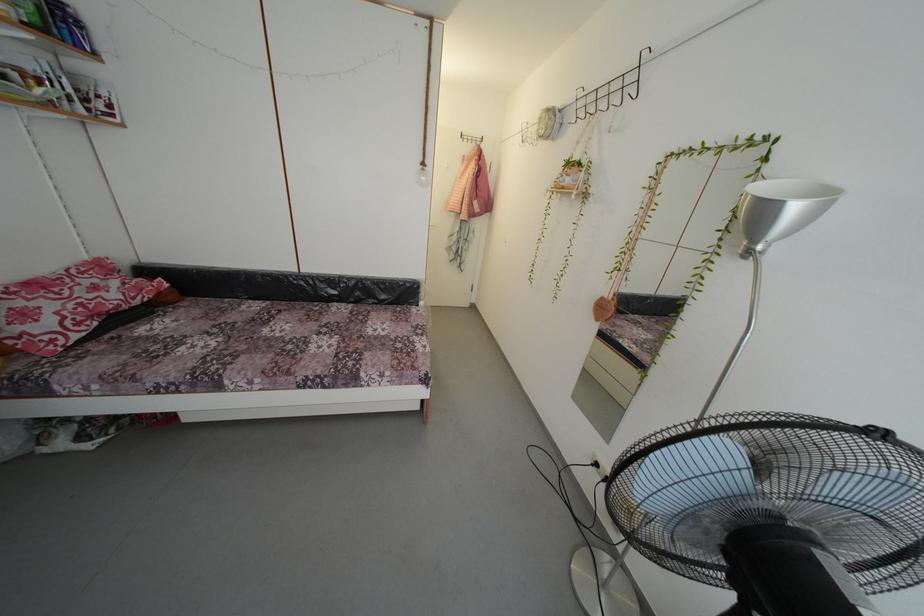
Find the location of a particular element. Image resolution: width=924 pixels, height=616 pixels. white power plug is located at coordinates (600, 466).